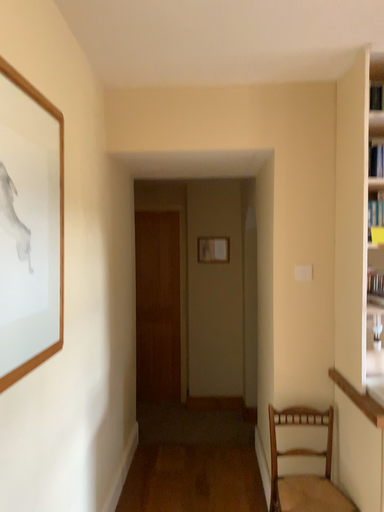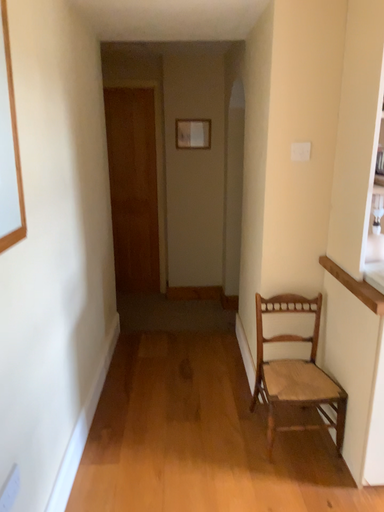
Question: Which way did the camera rotate in the video?

Choices:
 (A) rotated downward
 (B) rotated upward

Answer: (A)